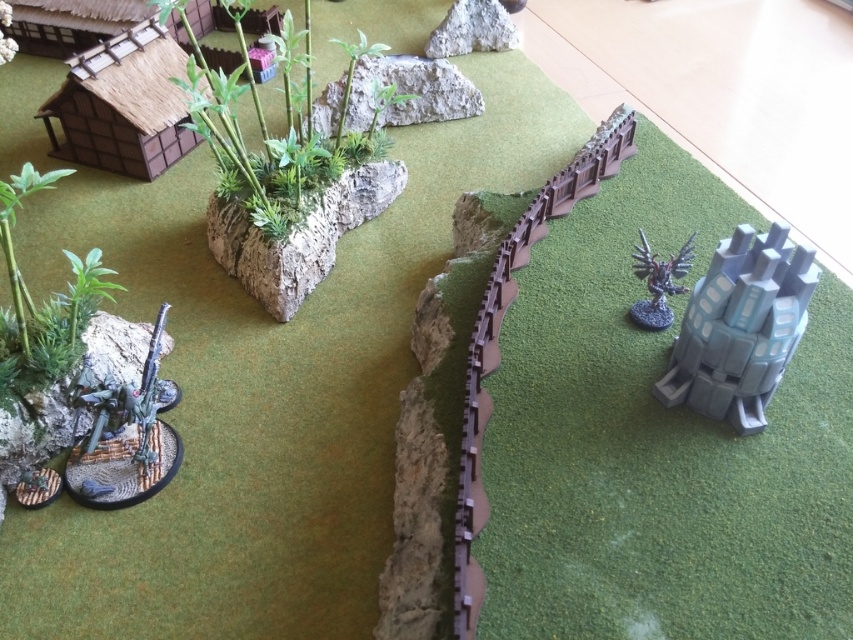
Question: Which object appears farthest from the camera in this image?

Choices:
 (A) gray rock at upper center
 (B) green leafy plant at left
 (C) gray stone at center

Answer: (A)

Question: Does wooden thatched hut at upper left have a greater width compared to gray stone at center?

Choices:
 (A) yes
 (B) no

Answer: (B)

Question: From the image, what is the correct spatial relationship of satin gray tower at right in relation to wooden thatched hut at upper left?

Choices:
 (A) below
 (B) above

Answer: (A)

Question: Estimate the real-world distances between objects in this image. Which object is closer to the wooden thatched hut at upper left?

Choices:
 (A) green leafy plant at upper left
 (B) metallic silver sword at lower left
 (C) gray rock at upper center
 (D) gray stone at center

Answer: (A)

Question: Does metallic silver sword at lower left have a larger size compared to shiny silver eagle at upper right?

Choices:
 (A) yes
 (B) no

Answer: (A)

Question: Which is nearer to the green leafy plant at left?

Choices:
 (A) satin gray tower at right
 (B) rough concrete rock at upper center

Answer: (B)